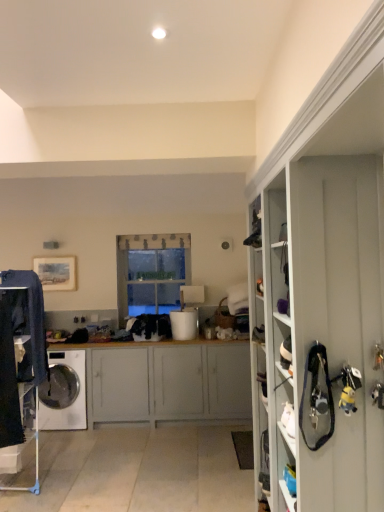
Question: From the image's perspective, is clear glass window at center under white matte cabinet at center?

Choices:
 (A) no
 (B) yes

Answer: (A)

Question: Is clear glass window at center aimed at white matte cabinet at center?

Choices:
 (A) no
 (B) yes

Answer: (A)

Question: Considering the relative sizes of clear glass window at center and white matte cabinet at center in the image provided, is clear glass window at center wider than white matte cabinet at center?

Choices:
 (A) yes
 (B) no

Answer: (B)

Question: Is there a large distance between clear glass window at center and white matte cabinet at center?

Choices:
 (A) yes
 (B) no

Answer: (A)

Question: Is clear glass window at center to the left of white matte cabinet at center from the viewer's perspective?

Choices:
 (A) no
 (B) yes

Answer: (A)

Question: Considering the relative positions of white glossy washing machine at lower left and dark blue denim jeans at left in the image provided, is white glossy washing machine at lower left to the left or to the right of dark blue denim jeans at left?

Choices:
 (A) right
 (B) left

Answer: (B)

Question: Considering the positions of white glossy washing machine at lower left and dark blue denim jeans at left in the image, is white glossy washing machine at lower left wider or thinner than dark blue denim jeans at left?

Choices:
 (A) wide
 (B) thin

Answer: (A)

Question: Is white glossy washing machine at lower left situated inside dark blue denim jeans at left or outside?

Choices:
 (A) inside
 (B) outside

Answer: (B)

Question: Is white glossy washing machine at lower left in front of or behind dark blue denim jeans at left in the image?

Choices:
 (A) behind
 (B) front

Answer: (A)

Question: From their relative heights in the image, would you say white matte cabinet at center is taller or shorter than white glossy washing machine at lower left?

Choices:
 (A) tall
 (B) short

Answer: (A)

Question: From a real-world perspective, is white matte cabinet at center above or below white glossy washing machine at lower left?

Choices:
 (A) above
 (B) below

Answer: (A)

Question: Would you say white matte cabinet at center is to the left or to the right of white glossy washing machine at lower left in the picture?

Choices:
 (A) left
 (B) right

Answer: (B)

Question: Is white matte cabinet at center spatially inside white glossy washing machine at lower left, or outside of it?

Choices:
 (A) inside
 (B) outside

Answer: (B)

Question: Considering the positions of point (145, 382) and point (4, 353), is point (145, 382) closer or farther from the camera than point (4, 353)?

Choices:
 (A) closer
 (B) farther

Answer: (B)

Question: From a real-world perspective, relative to dark blue denim jeans at left, is white matte cabinet at center vertically above or below?

Choices:
 (A) below
 (B) above

Answer: (A)